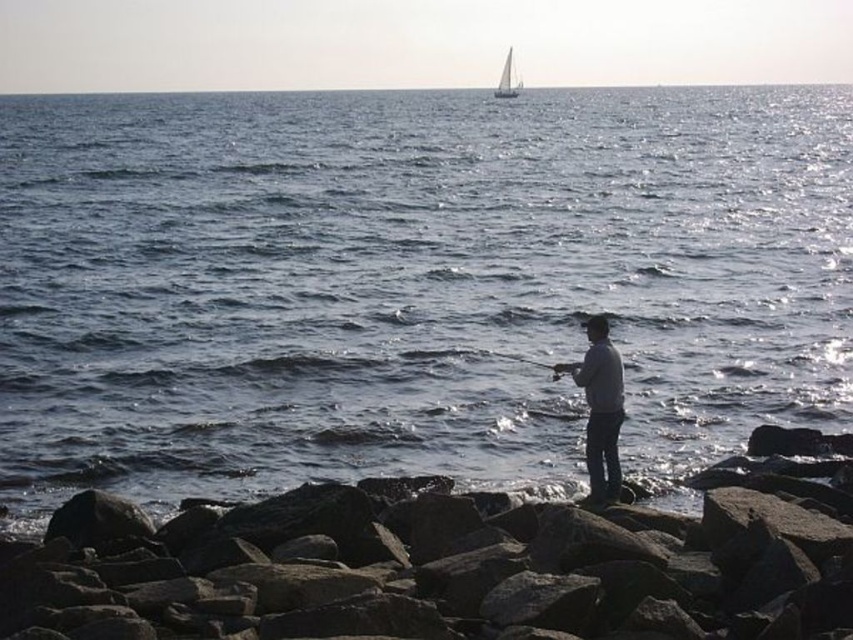
Is white sailboat at upper center positioned behind smooth black rod at center?

That is True.

The width and height of the screenshot is (853, 640). Identify the location of white sailboat at upper center. (508, 80).

Does point (500, 80) come farther from viewer compared to point (508, 358)?

That is True.

The width and height of the screenshot is (853, 640). I want to click on white sailboat at upper center, so click(x=508, y=80).

Between blue water at center and white sailboat at upper center, which one has more height?

Standing taller between the two is white sailboat at upper center.

Does blue water at center lie behind white sailboat at upper center?

That is False.

You are a GUI agent. You are given a task and a screenshot of the screen. Output one action in this format:
    pyautogui.click(x=<x>, y=<y>)
    Task: Click on the blue water at center
    The width and height of the screenshot is (853, 640).
    Given the screenshot: What is the action you would take?
    pyautogui.click(x=410, y=284)

How distant is gray cotton shirt at center from white sailboat at upper center?

gray cotton shirt at center and white sailboat at upper center are 147.62 meters apart from each other.

Consider the image. Which is more to the left, gray cotton shirt at center or white sailboat at upper center?

Positioned to the left is gray cotton shirt at center.

Does point (604, 420) lie in front of point (508, 60)?

Yes, point (604, 420) is in front of point (508, 60).

The height and width of the screenshot is (640, 853). I want to click on gray cotton shirt at center, so click(601, 408).